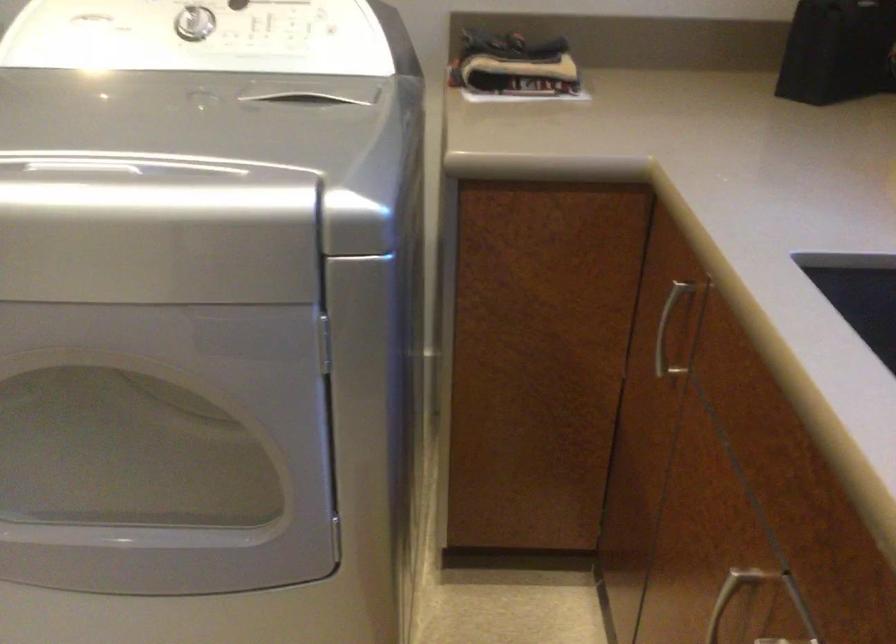
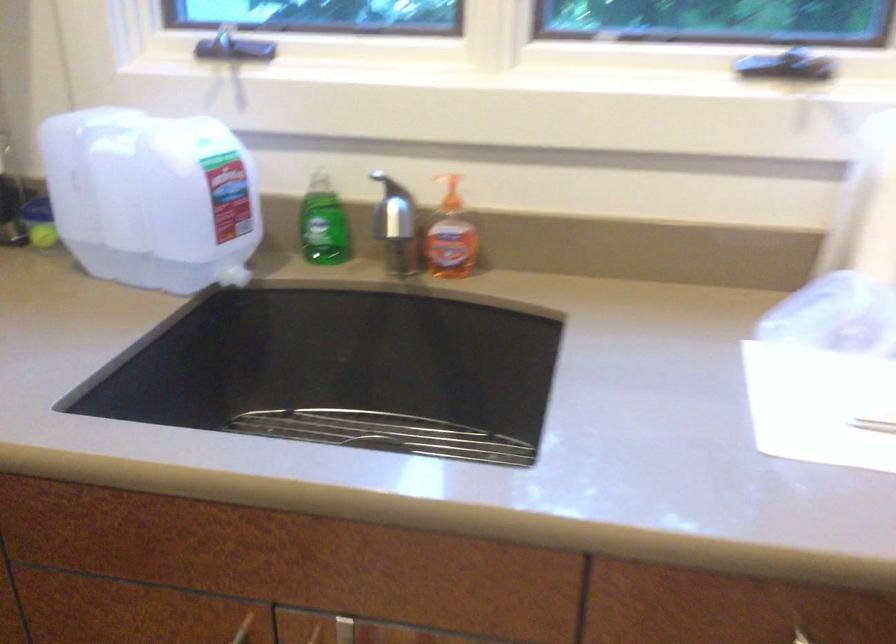
Locate, in the second image, the point that corresponds to the point at 764,570 in the first image.

(243, 629)